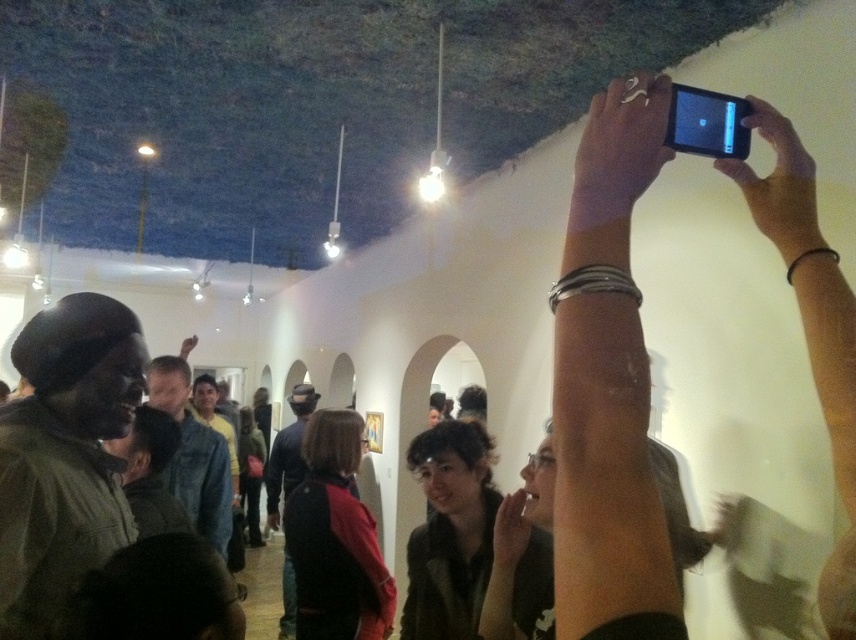
Can you confirm if smooth skin hand at upper right is thinner than black matte phone at upper right?

No.

Does smooth skin hand at upper right have a smaller size compared to black matte phone at upper right?

No.

At what (x,y) coordinates should I click in order to perform the action: click on smooth skin hand at upper right. Please return your answer as a coordinate pair (x, y). Looking at the image, I should click on (619, 150).